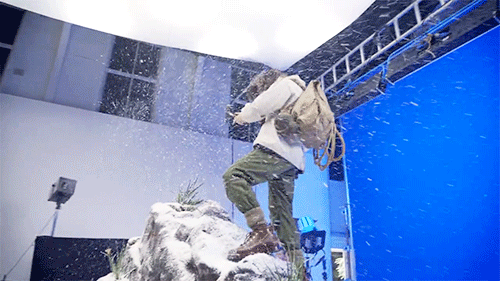
Locate an element on the screen. This screenshot has height=281, width=500. bright blue wall is located at coordinates (346, 171).